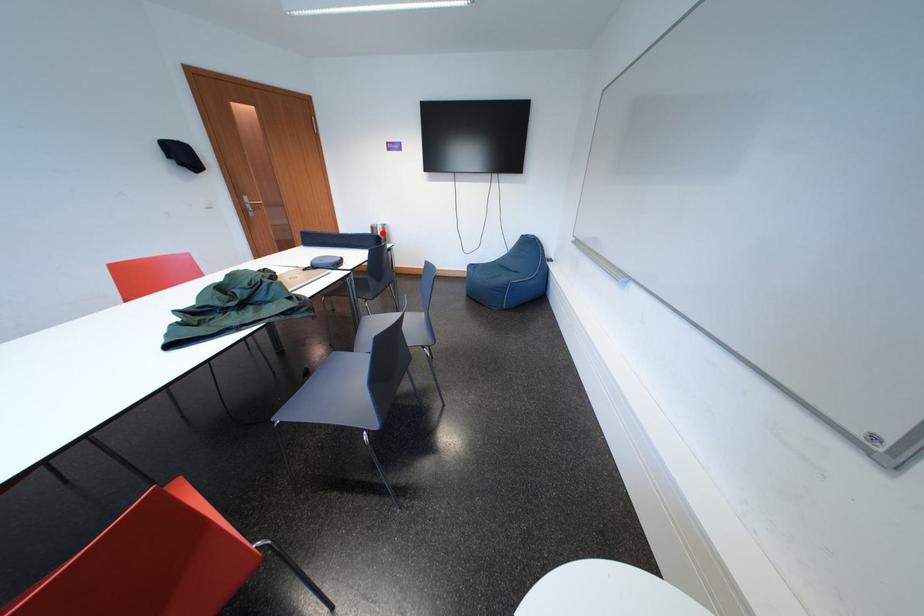
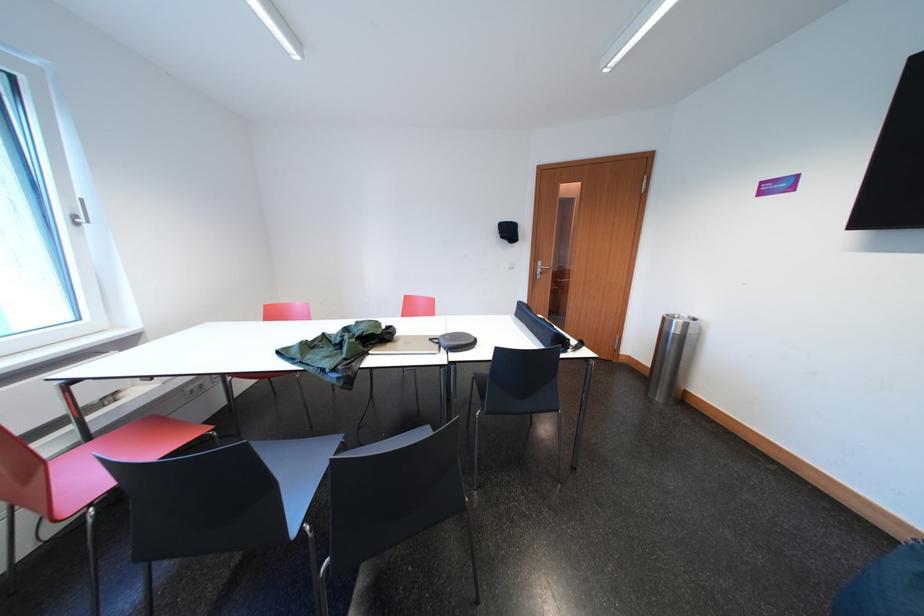
In the second image, find the point that corresponds to the highlighted location in the first image.

(675, 325)